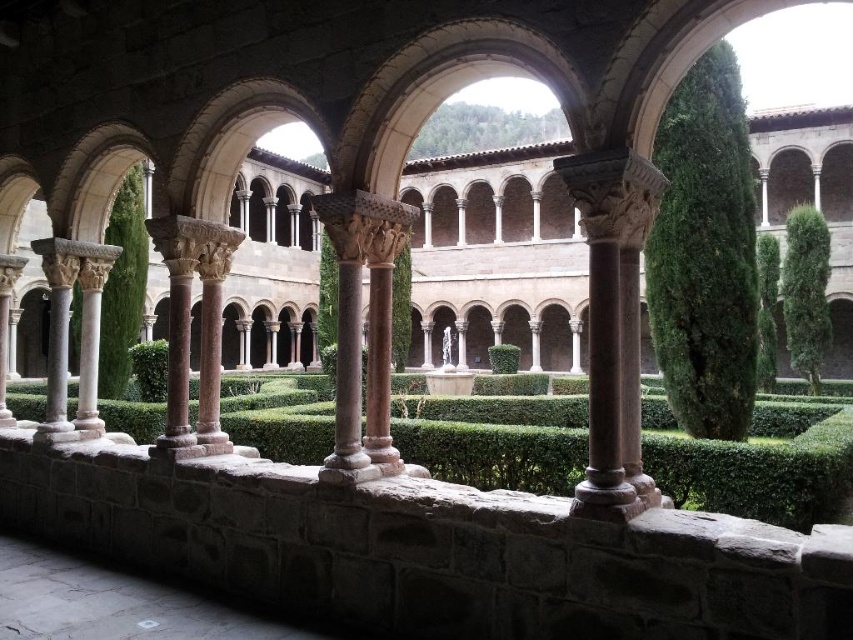
Question: Can you confirm if green leafy hedge at center right is bigger than green leafy hedge at left?

Choices:
 (A) no
 (B) yes

Answer: (A)

Question: Does brown stone column at center have a greater width compared to polished stone column at center?

Choices:
 (A) no
 (B) yes

Answer: (B)

Question: Can you confirm if green leafy hedge at left is thinner than green leafy hedge at center?

Choices:
 (A) yes
 (B) no

Answer: (B)

Question: Which object appears farthest from the camera in this image?

Choices:
 (A) green leafy hedge at center right
 (B) green leafy hedge at left
 (C) polished stone column at center

Answer: (B)

Question: Among these points, which one is nearest to the camera?

Choices:
 (A) (514, 369)
 (B) (61, 348)

Answer: (B)

Question: Which point is farther from the camera taking this photo?

Choices:
 (A) (724, 413)
 (B) (140, 310)

Answer: (B)